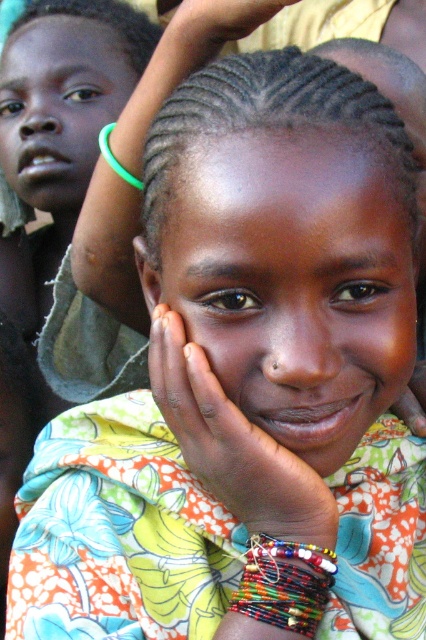
Based on the scene, which object is shorter between the matte floral dress at center and the matte skin face at upper left?

The matte floral dress at center is shorter than the matte skin face at upper left.

What are the coordinates of the beaded multicolored bracelet at lower center?

The beaded multicolored bracelet at lower center is located at coordinates (284, 582).

Consider the image. Looking at the girl in the image, can you determine which bracelet is positioned to the right between the beaded multicolored bracelet at lower center and the green rubber bracelet at center?

The beaded multicolored bracelet at lower center is positioned to the right of the green rubber bracelet at center according to the description.